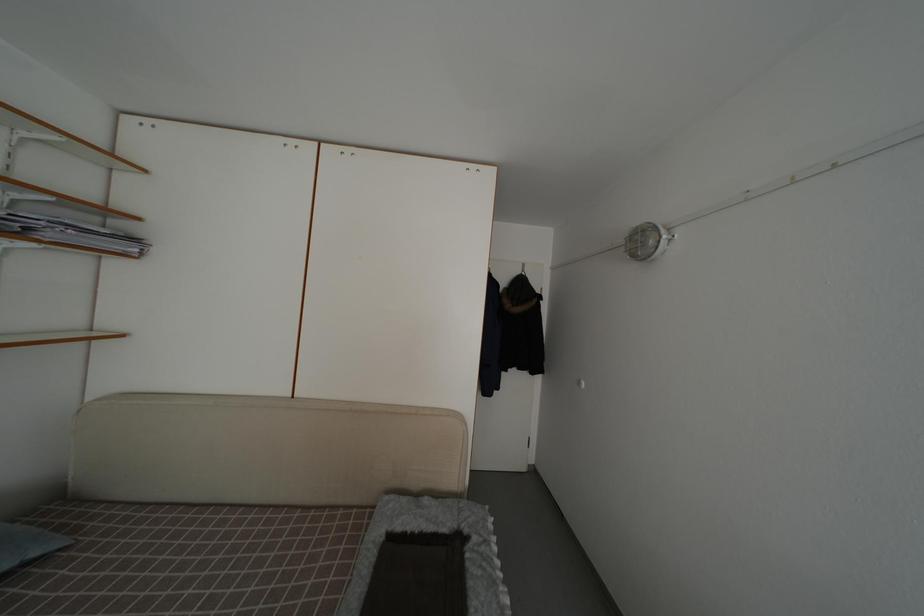
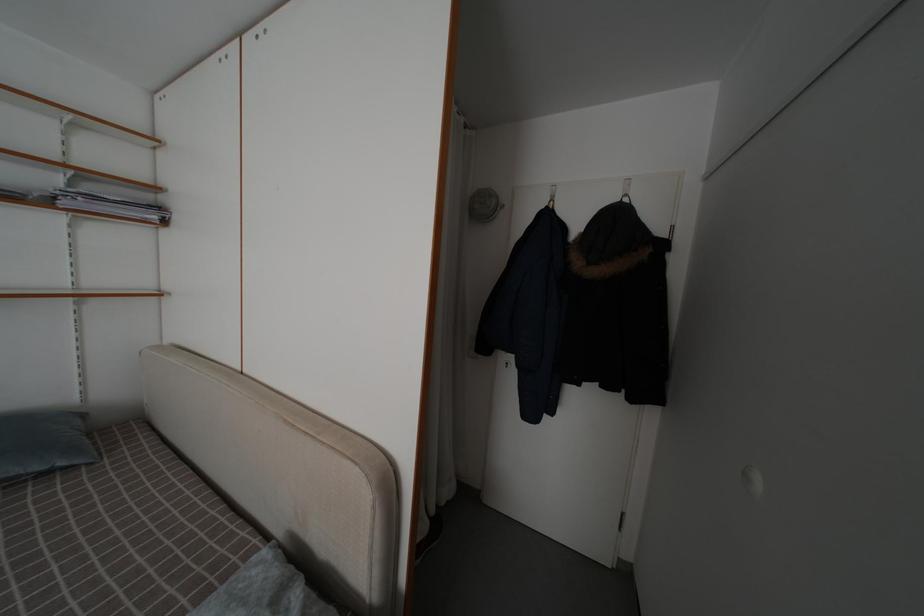
Where in the second image is the point corresponding to point (141, 257) from the first image?

(161, 224)